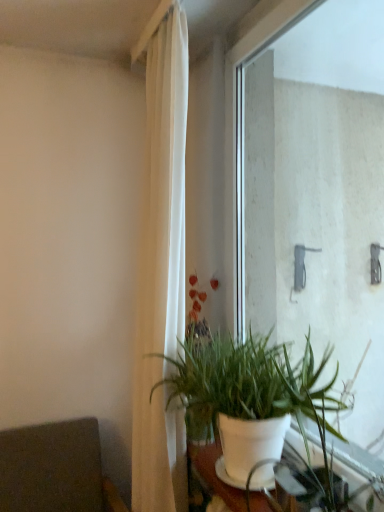
Question: Can you confirm if white matte pot at lower center is thinner than transparent glass window at center?

Choices:
 (A) yes
 (B) no

Answer: (B)

Question: From the image's perspective, is white matte pot at lower center over transparent glass window at center?

Choices:
 (A) no
 (B) yes

Answer: (A)

Question: Could you tell me if white matte pot at lower center is turned towards transparent glass window at center?

Choices:
 (A) no
 (B) yes

Answer: (A)

Question: Is white matte pot at lower center positioned beyond the bounds of transparent glass window at center?

Choices:
 (A) yes
 (B) no

Answer: (A)

Question: Is white matte pot at lower center to the right of transparent glass window at center from the viewer's perspective?

Choices:
 (A) yes
 (B) no

Answer: (B)

Question: In terms of size, does transparent glass window at center appear bigger or smaller than white matte pot at lower center?

Choices:
 (A) small
 (B) big

Answer: (A)

Question: From the image's perspective, is transparent glass window at center positioned above or below white matte pot at lower center?

Choices:
 (A) below
 (B) above

Answer: (B)

Question: Does point (382, 185) appear closer or farther from the camera than point (319, 407)?

Choices:
 (A) closer
 (B) farther

Answer: (B)

Question: From a real-world perspective, relative to white matte pot at lower center, is transparent glass window at center vertically above or below?

Choices:
 (A) below
 (B) above

Answer: (B)

Question: Considering the positions of white fabric curtain at center and transparent glass window at center in the image, is white fabric curtain at center taller or shorter than transparent glass window at center?

Choices:
 (A) tall
 (B) short

Answer: (A)

Question: Is white fabric curtain at center wider or thinner than transparent glass window at center?

Choices:
 (A) thin
 (B) wide

Answer: (B)

Question: Would you say white fabric curtain at center is to the left or to the right of transparent glass window at center in the picture?

Choices:
 (A) left
 (B) right

Answer: (A)

Question: Is point (137, 44) closer or farther from the camera than point (367, 393)?

Choices:
 (A) closer
 (B) farther

Answer: (A)

Question: Is white matte pot at lower center taller or shorter than transparent glass window at center?

Choices:
 (A) tall
 (B) short

Answer: (B)

Question: Which is correct: white matte pot at lower center is inside transparent glass window at center, or outside of it?

Choices:
 (A) inside
 (B) outside

Answer: (B)